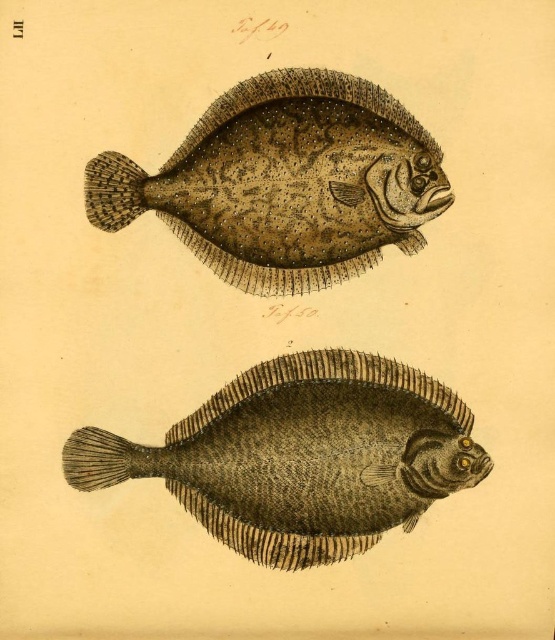
Question: Is brown textured fish at center in front of speckled textured fish at upper center?

Choices:
 (A) no
 (B) yes

Answer: (B)

Question: Does brown textured fish at center have a greater width compared to speckled textured fish at upper center?

Choices:
 (A) yes
 (B) no

Answer: (A)

Question: From the image, what is the correct spatial relationship of brown textured fish at center in relation to speckled textured fish at upper center?

Choices:
 (A) above
 (B) below

Answer: (B)

Question: Which of the following is the farthest from the observer?

Choices:
 (A) (107, 189)
 (B) (374, 465)

Answer: (B)

Question: Among these objects, which one is nearest to the camera?

Choices:
 (A) speckled textured fish at upper center
 (B) brown textured fish at center

Answer: (B)

Question: Among these points, which one is nearest to the camera?

Choices:
 (A) (133, 474)
 (B) (344, 195)

Answer: (A)